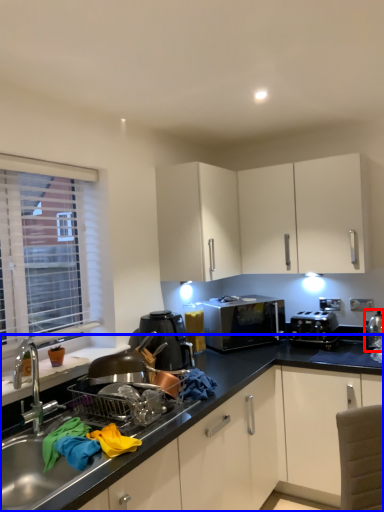
Question: Which object is closer to the camera taking this photo, appliance (highlighted by a red box) or countertop (highlighted by a blue box)?

Choices:
 (A) appliance
 (B) countertop

Answer: (B)